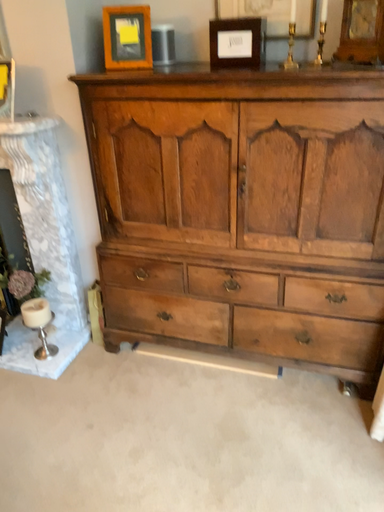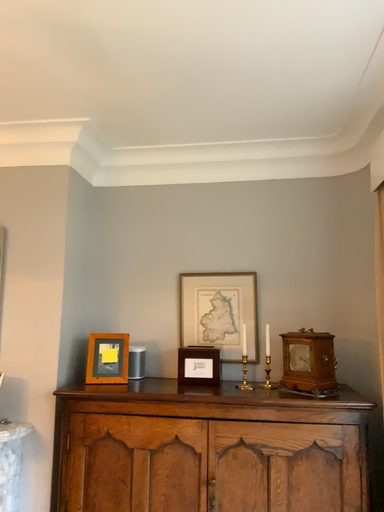
Question: Which way did the camera rotate in the video?

Choices:
 (A) rotated left
 (B) rotated right

Answer: (B)